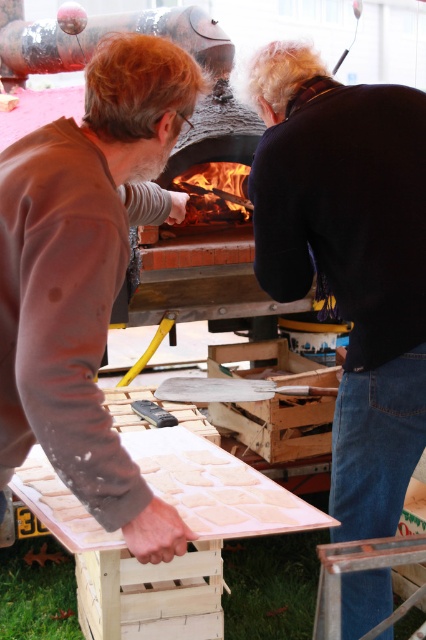
You are standing in front of the brick oven and want to hand a tool to both the black matte shirt at upper right and the brown matte sweater at left. Which person should you approach first to ensure you can reach them without moving around the oven?

You should approach the brown matte sweater at left first because they are behind the black matte shirt at upper right, so reaching them would require moving around the oven.

You are a photographer standing at the center of the scene. You want to capture a photo that includes both the black matte shirt at upper right and the brown matte sweater at left. What is the minimum distance you need to step back to ensure both are in frame?

The black matte shirt at upper right is 29.23 inches away from the brown matte sweater at left. To include both in the frame, you need to step back at least half that distance, so approximately 14.6 inches back.

Based on the photo, you are standing in front of the brick oven and want to hand a loaf of bread to both the black matte shirt at upper right and the brown matte sweater at left. Which person should you approach first if you want to give the bread to the one closer to the oven?

The brown matte sweater at left is closer to the oven than the black matte shirt at upper right, so you should approach the brown matte sweater at left first.